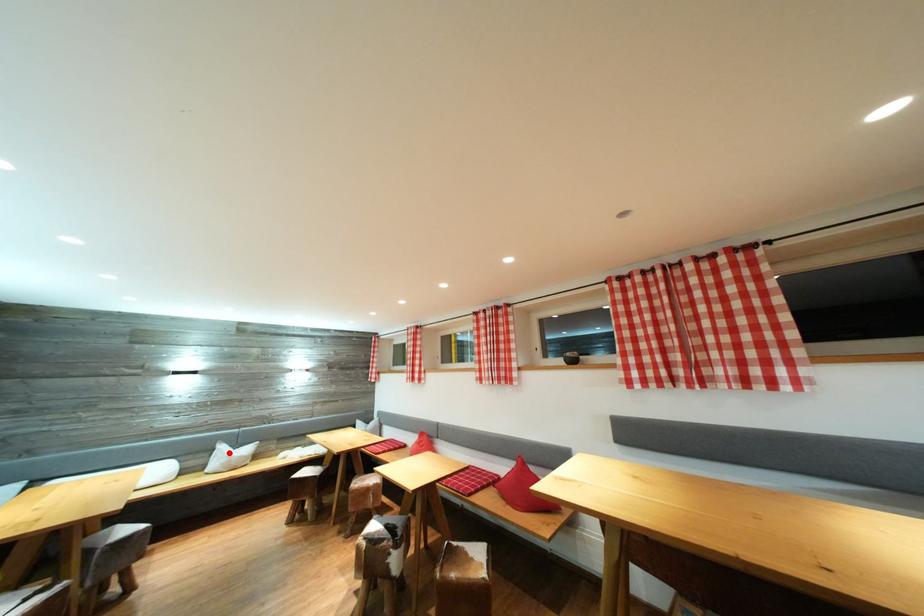
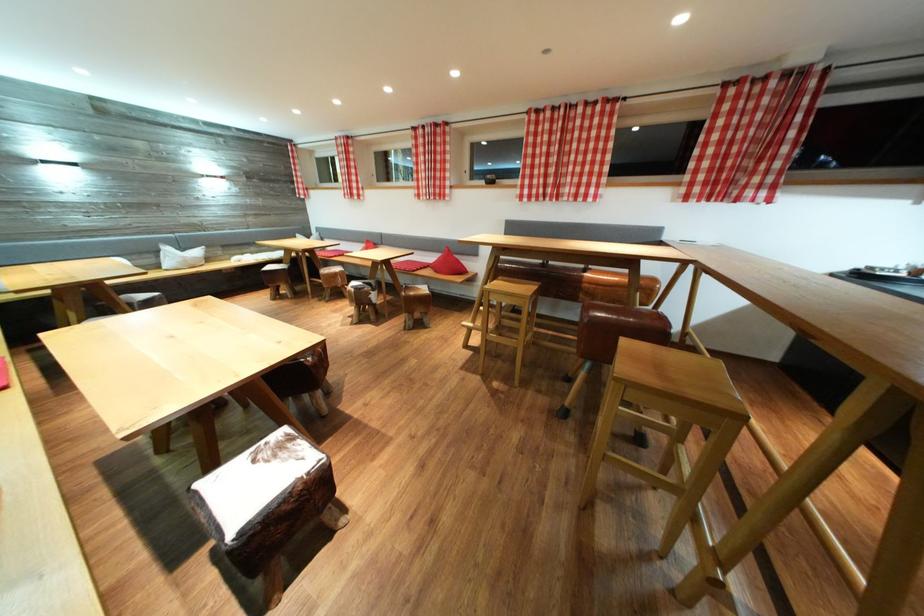
Question: I am providing you with two images of the same scene from different viewpoints. A red point is marked on the first image. At the location where the point appears in image 1, is it still visible in image 2?

Choices:
 (A) Yes
 (B) No

Answer: (A)